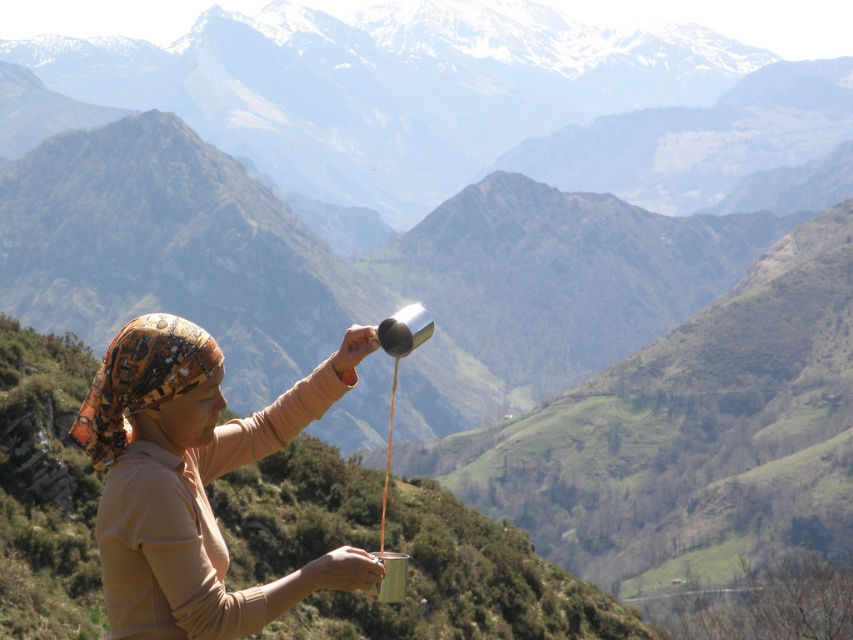
Question: Which object is closer to the camera taking this photo?

Choices:
 (A) matte beige shirt at center
 (B) printed silk headscarf at left

Answer: (A)

Question: Which of the following is the farthest from the observer?

Choices:
 (A) (189, 452)
 (B) (91, 410)

Answer: (A)

Question: Can you confirm if matte beige shirt at center is smaller than printed silk headscarf at left?

Choices:
 (A) no
 (B) yes

Answer: (A)

Question: Is matte beige shirt at center above printed silk headscarf at left?

Choices:
 (A) no
 (B) yes

Answer: (A)

Question: Is matte beige shirt at center to the right of printed silk headscarf at left from the viewer's perspective?

Choices:
 (A) yes
 (B) no

Answer: (A)